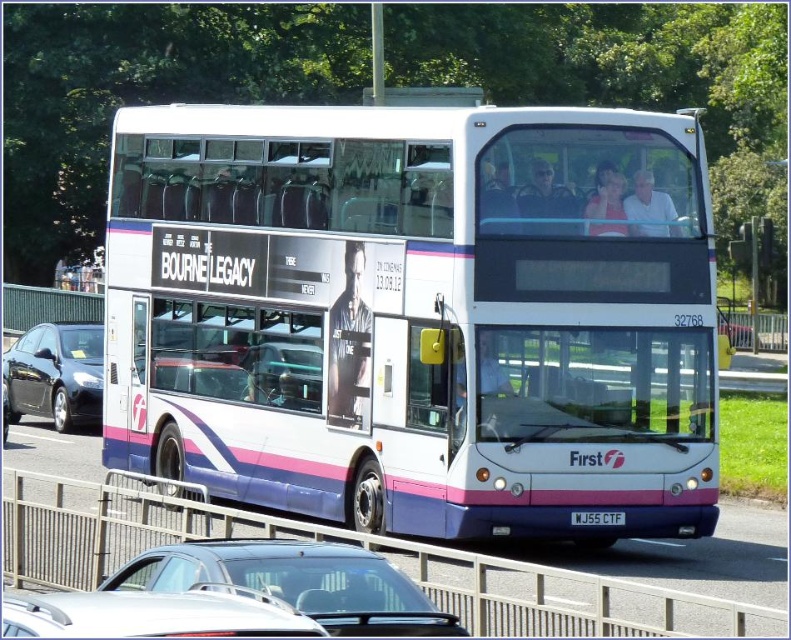
Question: Which of the following is the farthest from the observer?

Choices:
 (A) shiny black sedan at left
 (B) silver metallic car at center

Answer: (A)

Question: Based on their relative distances, which object is farther from the white glossy bus at center?

Choices:
 (A) shiny black sedan at left
 (B) silver metallic car at center

Answer: (A)

Question: Is silver metallic car at center to the right of shiny black sedan at left from the viewer's perspective?

Choices:
 (A) no
 (B) yes

Answer: (B)

Question: Which point is farther from the camera taking this photo?

Choices:
 (A) (74, 410)
 (B) (621, 522)
 (C) (271, 259)
 (D) (168, 554)

Answer: (A)

Question: Is white glossy bus at center smaller than white plastic license plate at center?

Choices:
 (A) yes
 (B) no

Answer: (B)

Question: Is white glossy bus at center smaller than silver metallic car at center?

Choices:
 (A) no
 (B) yes

Answer: (A)